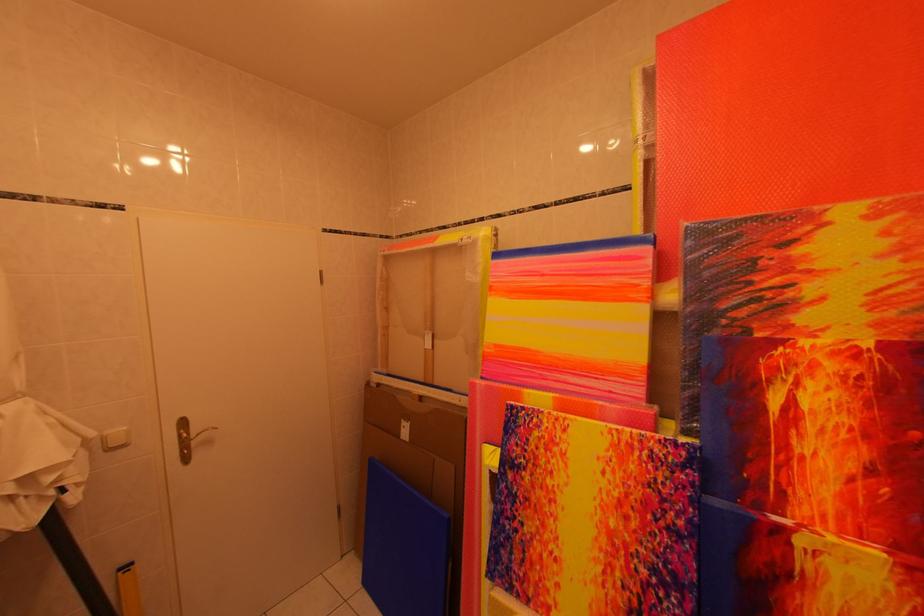
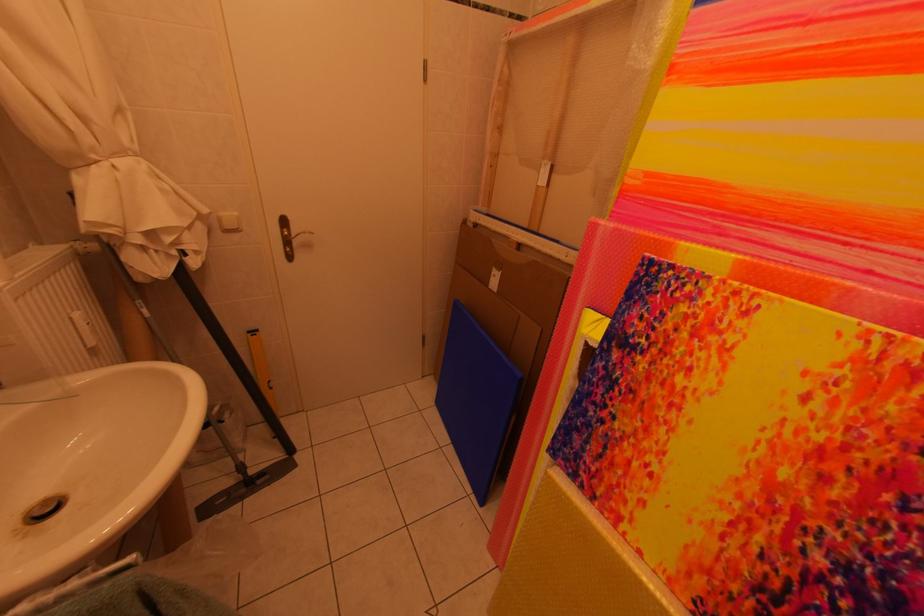
Where in the second image is the point corresponding to the point at 185,426 from the first image?

(286, 223)